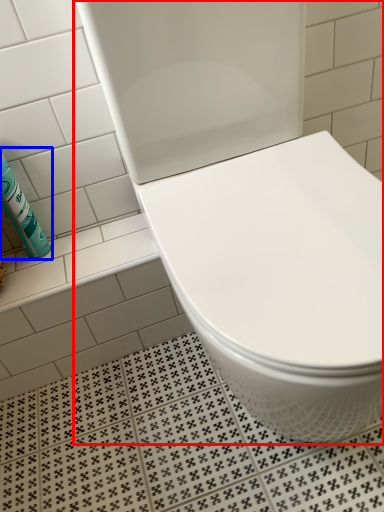
Question: Which of the following is the closest to the observer, toilet (highlighted by a red box) or cleaning product (highlighted by a blue box)?

Choices:
 (A) toilet
 (B) cleaning product

Answer: (A)